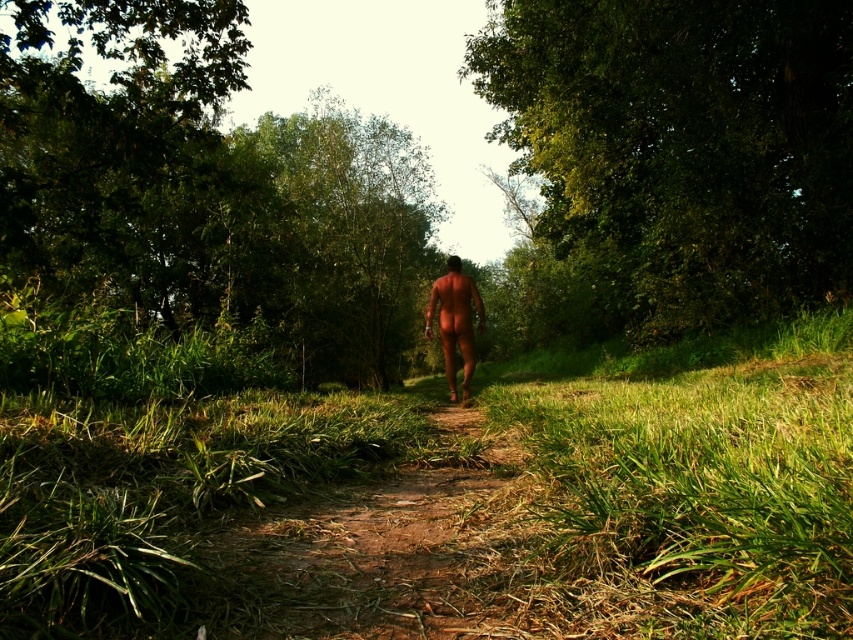
Question: Based on their relative distances, which object is nearer to the smooth skin man at center?

Choices:
 (A) green leafy tree at center
 (B) green grass at center
 (C) dirt path at center
 (D) green leafy tree at upper right

Answer: (C)

Question: Is green leafy tree at center to the right of dirt path at center from the viewer's perspective?

Choices:
 (A) no
 (B) yes

Answer: (A)

Question: Which point is farther to the camera?

Choices:
 (A) smooth skin man at center
 (B) green leafy tree at center

Answer: (A)

Question: Does green grass at center have a lesser width compared to green leafy tree at upper right?

Choices:
 (A) no
 (B) yes

Answer: (B)

Question: Among these objects, which one is farthest from the camera?

Choices:
 (A) dirt path at center
 (B) green leafy tree at upper right

Answer: (B)

Question: Can you confirm if green leafy tree at center is bigger than dirt path at center?

Choices:
 (A) no
 (B) yes

Answer: (B)